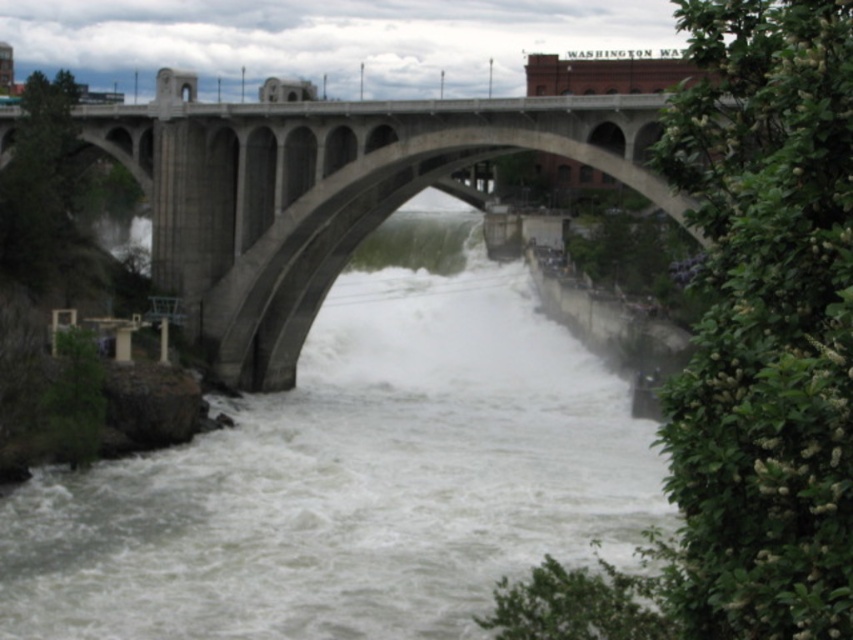
Question: Is white frothy water at center below concrete bridge at center?

Choices:
 (A) no
 (B) yes

Answer: (B)

Question: Which point is closer to the camera?

Choices:
 (A) (111, 525)
 (B) (230, 248)

Answer: (A)

Question: Which of the following is the farthest from the observer?

Choices:
 (A) concrete bridge at center
 (B) white frothy water at center

Answer: (B)

Question: Which object appears farthest from the camera in this image?

Choices:
 (A) concrete bridge at center
 (B) white frothy water at center

Answer: (B)

Question: Is white frothy water at center bigger than concrete bridge at center?

Choices:
 (A) yes
 (B) no

Answer: (A)

Question: Can you confirm if white frothy water at center is bigger than concrete bridge at center?

Choices:
 (A) yes
 (B) no

Answer: (A)